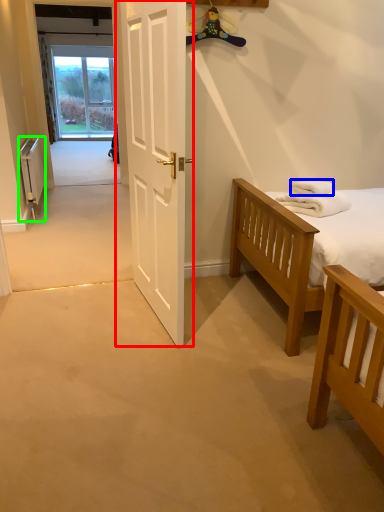
Question: Considering the real-world distances, which object is farthest from door (highlighted by a red box)? towel/napkin (highlighted by a blue box) or radiator (highlighted by a green box)?

Choices:
 (A) towel/napkin
 (B) radiator

Answer: (B)